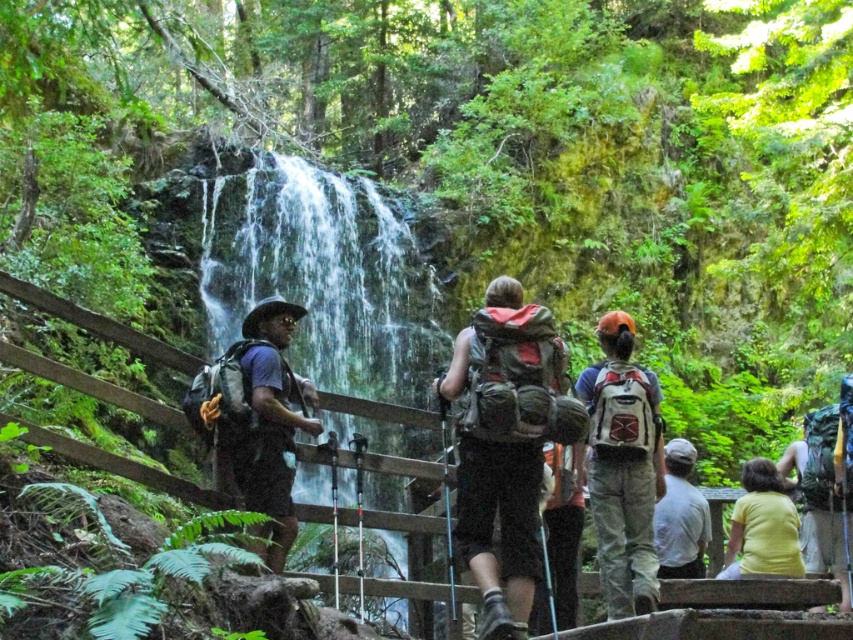
You are a drone operator trying to capture a photo of the waterfall. You have two points marked in the scene for reference. The first point is at coordinates point [459,451] and the second is at point [755,572]. Which point should you focus on to ensure the waterfall is in the foreground of your photo?

Point [459,451] is closer to the camera than point [755,572], so focusing on point [459,451] will ensure the waterfall is in the foreground of your photo.

You are a hiker who wants to retrieve your matte green backpack at center. The wooden railing is in your way. Can you reach your backpack without crossing the wooden railing?

Yes, because the matte green backpack at center is located at point (506, 444) which is on your side of the wooden railing.

You are a hiker planning to cross a narrow wooden bridge that is 4 meters wide. You notice the matte green backpack at center and the matte black backpack at left are placed on the bridge. Can both backpacks fit on the bridge simultaneously without overlapping?

The distance between the matte green backpack at center and the matte black backpack at left is 5.03 meters. Since the bridge is only 4 meters wide, the two backpacks cannot fit side by side on the bridge without overlapping.